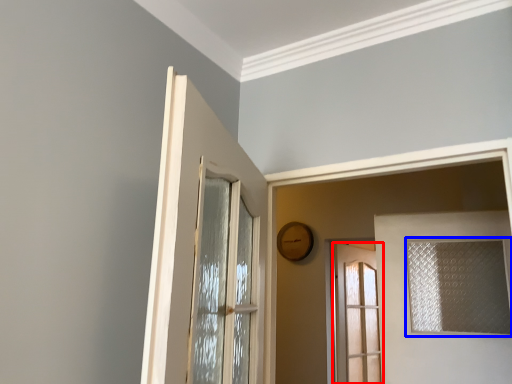
Question: Among these objects, which one is nearest to the camera, door (highlighted by a red box) or window (highlighted by a blue box)?

Choices:
 (A) door
 (B) window

Answer: (B)